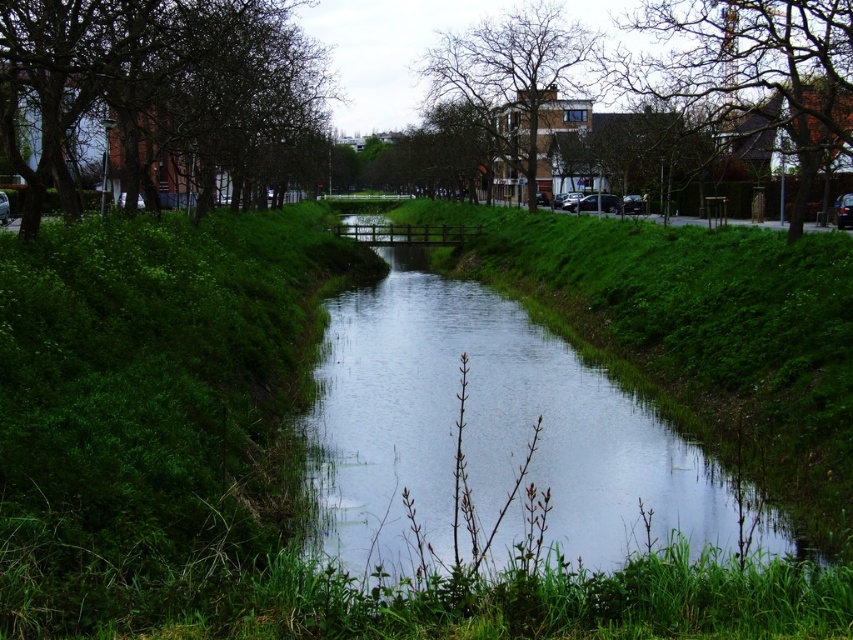
Can you confirm if bare branches at upper right is smaller than bare branches at upper center?

Incorrect, bare branches at upper right is not smaller in size than bare branches at upper center.

Is bare branches at upper right thinner than bare branches at upper center?

Incorrect, bare branches at upper right's width is not less than bare branches at upper center's.

Does point (683, 61) come closer to viewer compared to point (508, 26)?

Yes, it is.

The height and width of the screenshot is (640, 853). Identify the location of bare branches at upper right. [x=753, y=67].

Can you confirm if dark brown textured tree at left is positioned to the right of bare branches at upper right?

No, dark brown textured tree at left is not to the right of bare branches at upper right.

Who is lower down, dark brown textured tree at left or bare branches at upper right?

dark brown textured tree at left

Where is `dark brown textured tree at left`? Image resolution: width=853 pixels, height=640 pixels. dark brown textured tree at left is located at coordinates (157, 77).

You are a GUI agent. You are given a task and a screenshot of the screen. Output one action in this format:
    pyautogui.click(x=<x>, y=<y>)
    Task: Click on the dark brown textured tree at left
    Image resolution: width=853 pixels, height=640 pixels.
    Given the screenshot: What is the action you would take?
    pyautogui.click(x=157, y=77)

Between dark brown textured tree at left and bare branches at upper center, which one is positioned higher?

bare branches at upper center is above.

Between dark brown textured tree at left and bare branches at upper center, which one has more height?

With more height is bare branches at upper center.

Which is in front, point (83, 38) or point (579, 32)?

Positioned in front is point (83, 38).

In order to click on dark brown textured tree at left in this screenshot , I will do `click(157, 77)`.